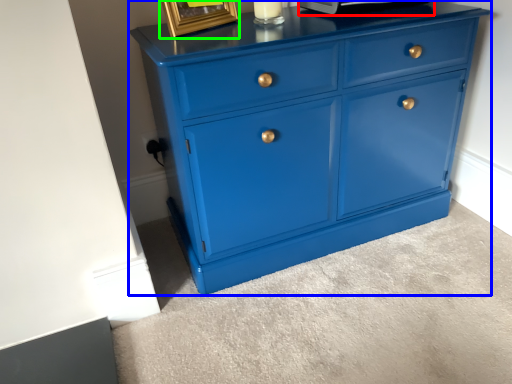
Question: Which is nearer to the appliance (highlighted by a red box)? chest of drawers (highlighted by a blue box) or picture frame (highlighted by a green box).

Choices:
 (A) chest of drawers
 (B) picture frame

Answer: (B)